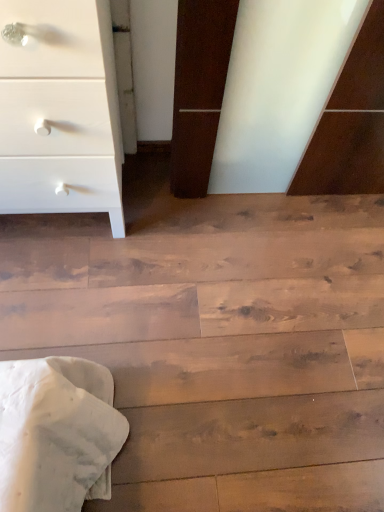
Locate an element on the screen. This screenshot has height=512, width=384. vacant space in white matte chest of drawers at upper left (from a real-world perspective) is located at coordinates (57, 228).